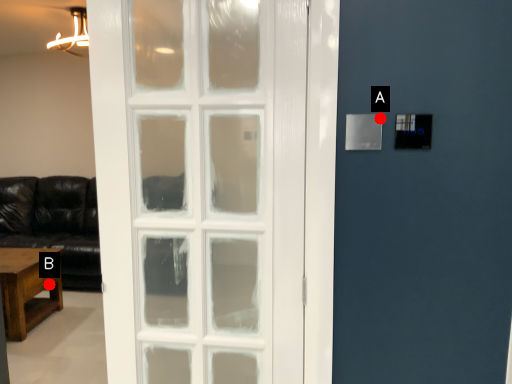
Question: Two points are circled on the image, labeled by A and B beside each circle. Which of the following is the closest to the observer?

Choices:
 (A) A is closer
 (B) B is closer

Answer: (A)